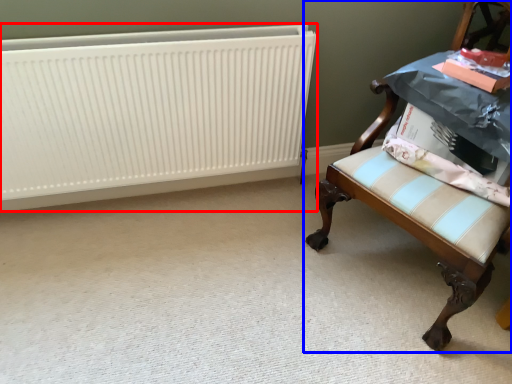
Question: Which point is closer to the camera, radiator (highlighted by a red box) or chair (highlighted by a blue box)?

Choices:
 (A) radiator
 (B) chair

Answer: (B)